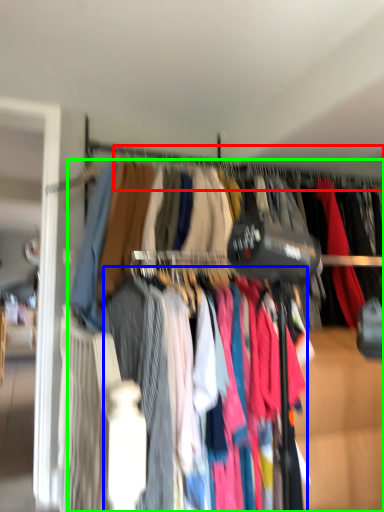
Question: Which object is the closest to the clothesline (highlighted by a red box)? Choose among these: clothing (highlighted by a blue box) or trousers (highlighted by a green box).

Choices:
 (A) clothing
 (B) trousers

Answer: (A)